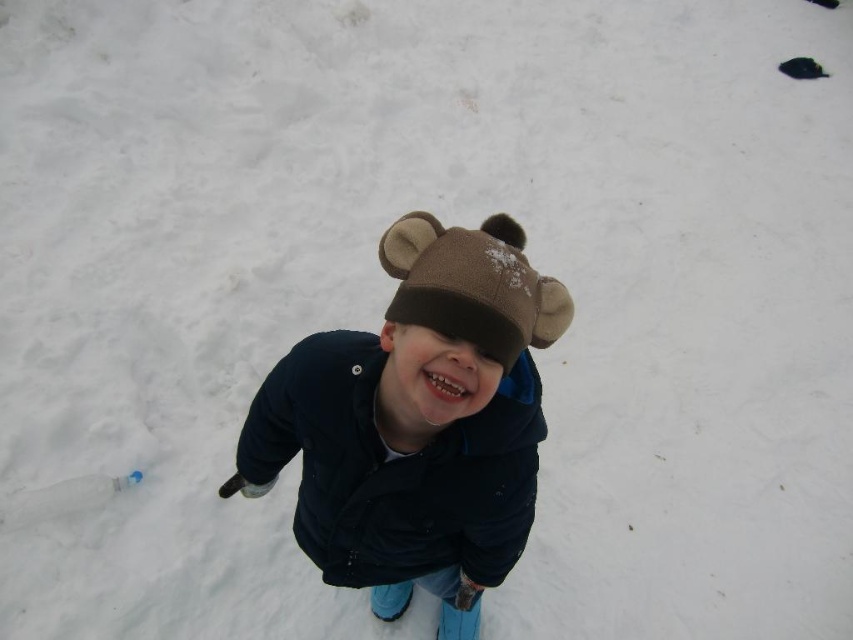
Is dark blue fleece jacket at center behind brown fleece hat at center?

Yes.

Who is shorter, dark blue fleece jacket at center or brown fleece hat at center?

brown fleece hat at center is shorter.

The width and height of the screenshot is (853, 640). Identify the location of dark blue fleece jacket at center. (416, 422).

The height and width of the screenshot is (640, 853). I want to click on dark blue fleece jacket at center, so click(416, 422).